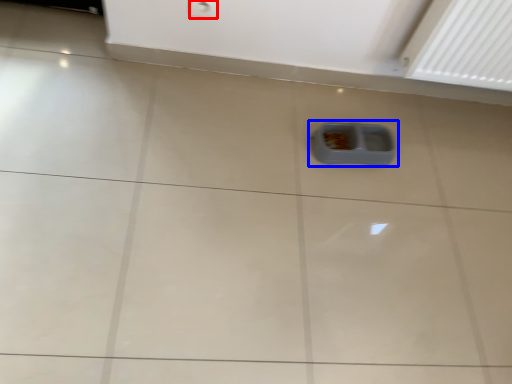
Question: Which point is further to the camera, electric outlet (highlighted by a red box) or waste container (highlighted by a blue box)?

Choices:
 (A) electric outlet
 (B) waste container

Answer: (B)